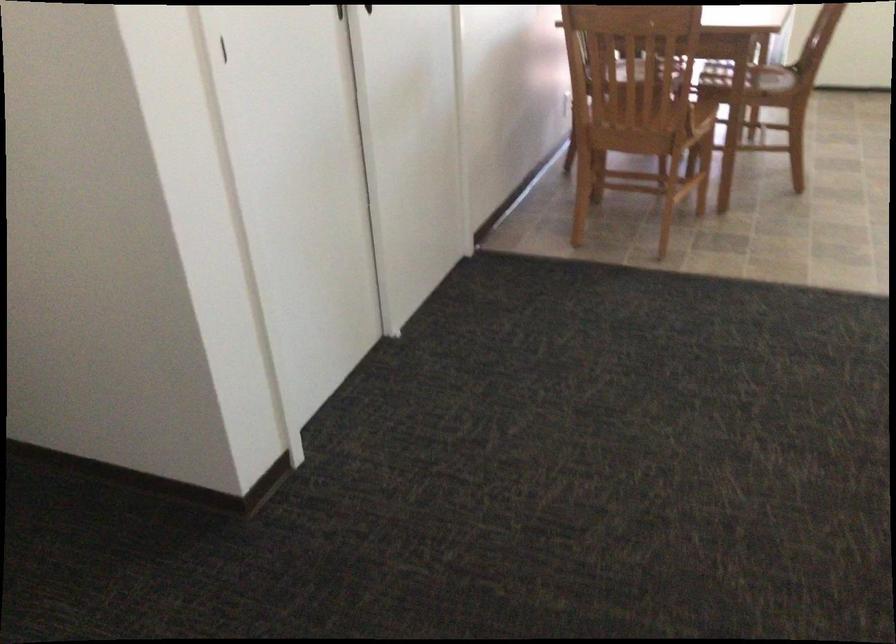
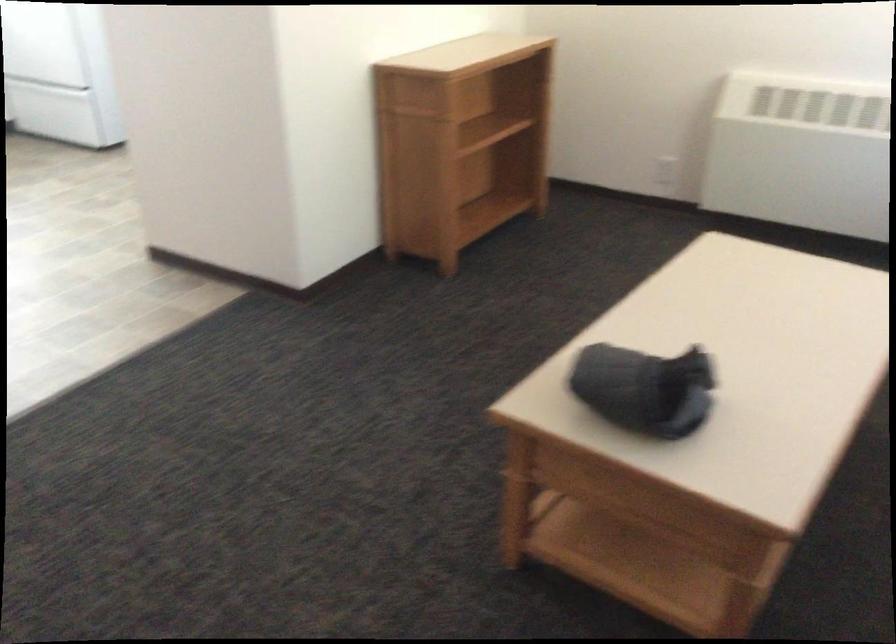
The first image is from the beginning of the video and the second image is from the end. How did the camera likely rotate when shooting the video?

The camera's rotation is toward right-down.